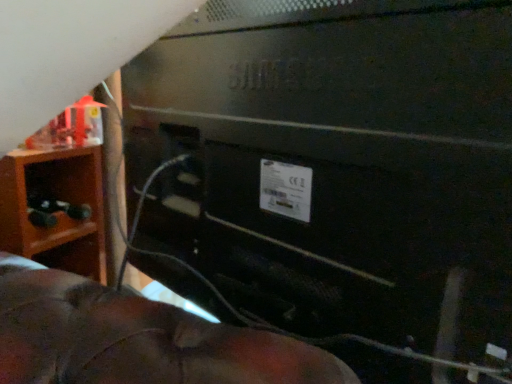
Question: Can you confirm if matte black toy at left is thinner than brown wood nightstand at left?

Choices:
 (A) no
 (B) yes

Answer: (B)

Question: From the image's perspective, is matte black toy at left on top of brown wood nightstand at left?

Choices:
 (A) yes
 (B) no

Answer: (A)

Question: Considering the relative sizes of matte black toy at left and brown wood nightstand at left in the image provided, is matte black toy at left bigger than brown wood nightstand at left?

Choices:
 (A) yes
 (B) no

Answer: (B)

Question: Does matte black toy at left contain brown wood nightstand at left?

Choices:
 (A) yes
 (B) no

Answer: (B)

Question: Does matte black toy at left have a greater height compared to brown wood nightstand at left?

Choices:
 (A) yes
 (B) no

Answer: (B)

Question: Could you tell me if matte black toy at left is facing brown wood nightstand at left?

Choices:
 (A) no
 (B) yes

Answer: (A)

Question: From a real-world perspective, is brown wood nightstand at left located higher than matte black toy at left?

Choices:
 (A) no
 (B) yes

Answer: (A)

Question: From the image's perspective, is brown wood nightstand at left located above matte black toy at left?

Choices:
 (A) no
 (B) yes

Answer: (A)

Question: Does brown wood nightstand at left lie behind matte black toy at left?

Choices:
 (A) no
 (B) yes

Answer: (B)

Question: Can you confirm if brown wood nightstand at left is shorter than matte black toy at left?

Choices:
 (A) no
 (B) yes

Answer: (A)

Question: Is brown wood nightstand at left to the left of matte black toy at left from the viewer's perspective?

Choices:
 (A) no
 (B) yes

Answer: (B)

Question: Is brown wood nightstand at left smaller than matte black toy at left?

Choices:
 (A) no
 (B) yes

Answer: (A)

Question: Is the position of black matte wire at center more distant than that of matte black toy at left?

Choices:
 (A) no
 (B) yes

Answer: (A)